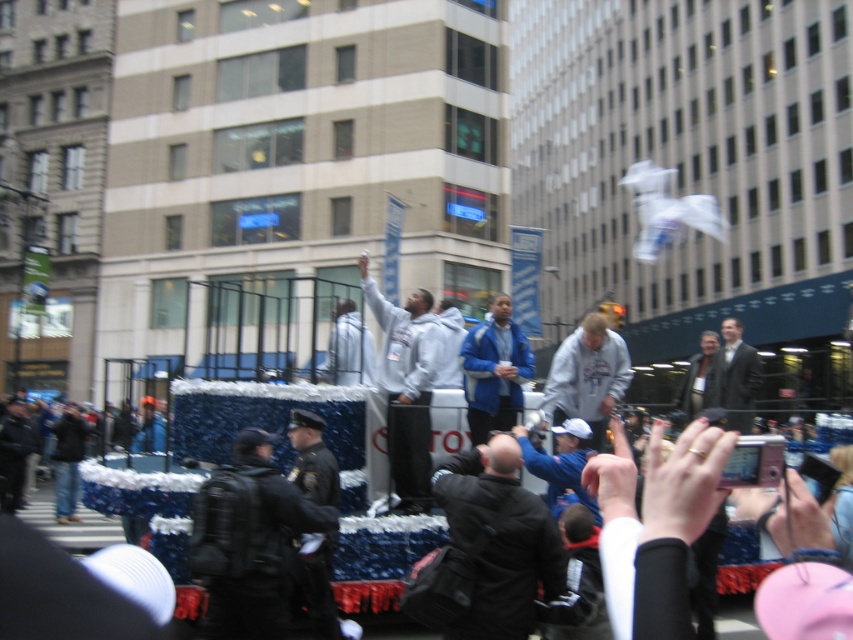
The width and height of the screenshot is (853, 640). Identify the location of gray fleece sweatshirt at center. (587, 376).

The width and height of the screenshot is (853, 640). Describe the element at coordinates (587, 376) in the screenshot. I see `gray fleece sweatshirt at center` at that location.

Between point (598, 416) and point (312, 563), which one is positioned behind?

Point (598, 416)

Locate an element on the screen. Image resolution: width=853 pixels, height=640 pixels. gray fleece sweatshirt at center is located at coordinates (587, 376).

Can you confirm if black uniformed officer at center is positioned to the left of black leather jacket at center?

Correct, you'll find black uniformed officer at center to the left of black leather jacket at center.

Locate an element on the screen. The height and width of the screenshot is (640, 853). black uniformed officer at center is located at coordinates (248, 540).

The height and width of the screenshot is (640, 853). Describe the element at coordinates (248, 540) in the screenshot. I see `black uniformed officer at center` at that location.

You are a GUI agent. You are given a task and a screenshot of the screen. Output one action in this format:
    pyautogui.click(x=<x>, y=<y>)
    Task: Click on the black uniformed officer at center
    The width and height of the screenshot is (853, 640).
    Given the screenshot: What is the action you would take?
    pyautogui.click(x=248, y=540)

The height and width of the screenshot is (640, 853). In order to click on black uniformed officer at center in this screenshot , I will do `click(248, 540)`.

Does point (253, 506) come closer to viewer compared to point (310, 566)?

Yes, it is in front of point (310, 566).

Measure the distance between point [277,611] and camera.

A distance of 6.70 meters exists between point [277,611] and camera.

Identify the location of black uniformed officer at center. The image size is (853, 640). (248, 540).